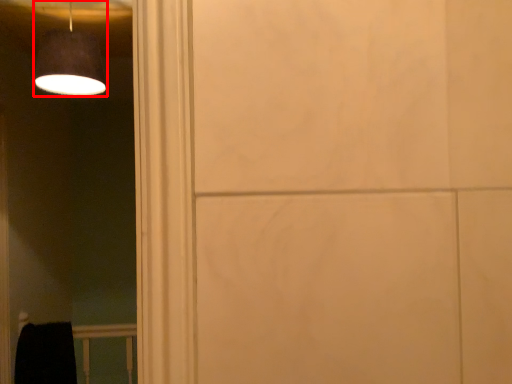
Question: Where is lamp (annotated by the red box) located in relation to balustrade in the image?

Choices:
 (A) right
 (B) left

Answer: (A)